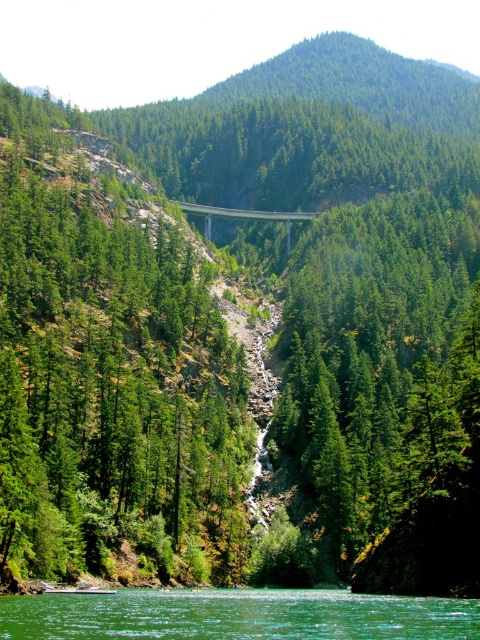
Question: Among these points, which one is nearest to the camera?

Choices:
 (A) 283,218
 (B) 243,621

Answer: (B)

Question: Is green smooth water at lower center bigger than concrete bridge at center?

Choices:
 (A) yes
 (B) no

Answer: (A)

Question: Is green smooth water at lower center bigger than concrete bridge at center?

Choices:
 (A) no
 (B) yes

Answer: (B)

Question: Which object is closer to the camera taking this photo?

Choices:
 (A) concrete bridge at center
 (B) green smooth water at lower center

Answer: (B)

Question: Does green smooth water at lower center have a greater width compared to concrete bridge at center?

Choices:
 (A) no
 (B) yes

Answer: (A)

Question: Which point is farther to the camera?

Choices:
 (A) green smooth water at lower center
 (B) concrete bridge at center

Answer: (B)